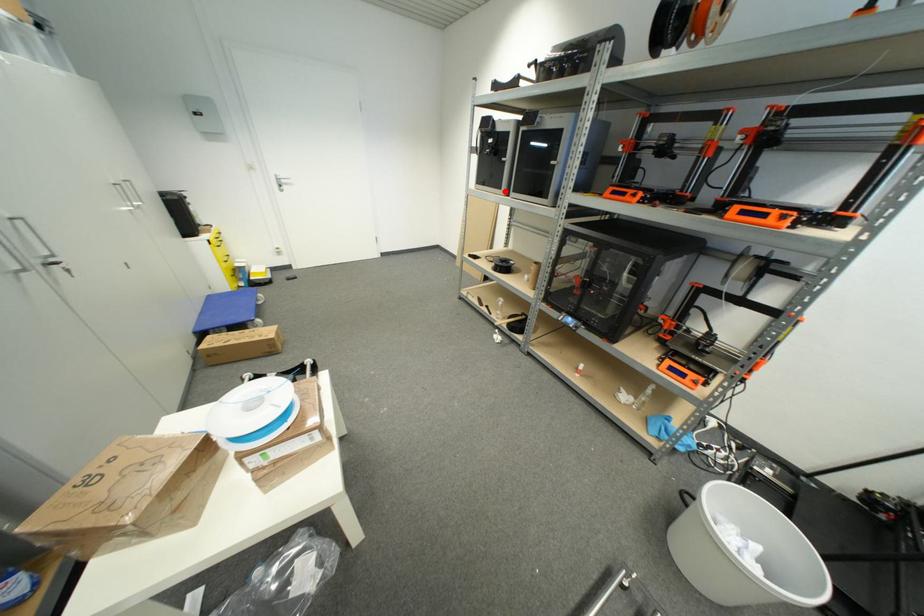
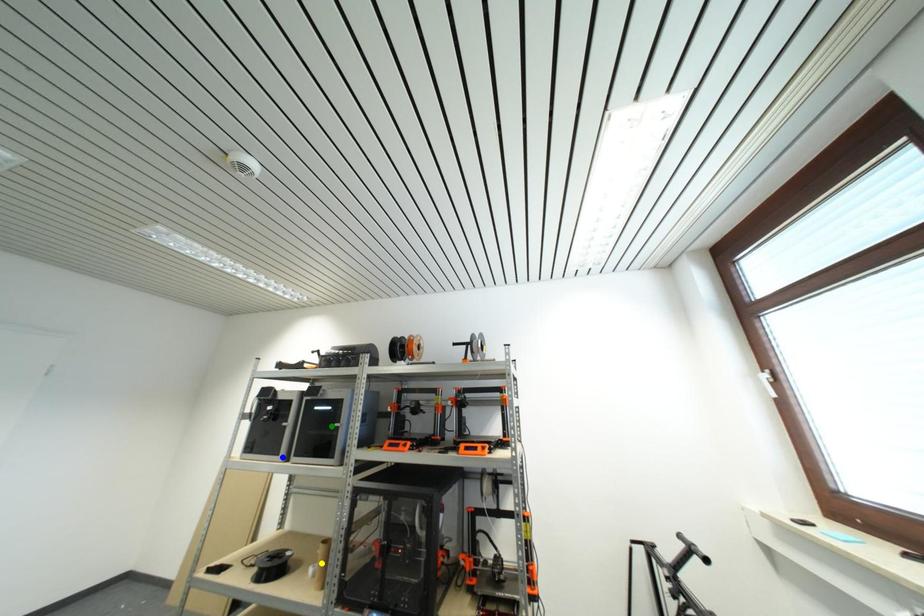
Question: I am providing you with two images of the same scene from different viewpoints. A red point is marked on the first image. You are given multiple points on the second image. Which mark in image 2 goes with the point in image 1?

Choices:
 (A) green point
 (B) blue point
 (C) yellow point

Answer: (B)